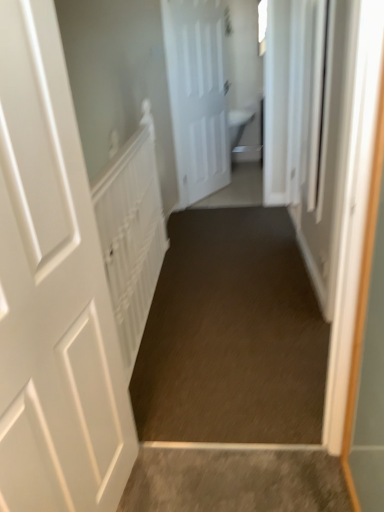
Question: Which direction should I rotate to look at white matte door at center, which is the first door from right to left, — up or down?

Choices:
 (A) up
 (B) down

Answer: (A)

Question: Is white matte door at left, the 2th door viewed from the right, at the right side of brown carpet at center?

Choices:
 (A) yes
 (B) no

Answer: (B)

Question: Is white matte door at left, placed as the first door when sorted from left to right, not close to brown carpet at center?

Choices:
 (A) yes
 (B) no

Answer: (B)

Question: Is the surface of white matte door at left, positioned as the second door in back-to-front order, in direct contact with brown carpet at center?

Choices:
 (A) no
 (B) yes

Answer: (A)

Question: Can you confirm if white matte door at left, positioned as the second door in back-to-front order, is bigger than brown carpet at center?

Choices:
 (A) no
 (B) yes

Answer: (A)

Question: Could brown carpet at center be considered to be inside white matte door at left, placed as the first door when sorted from left to right?

Choices:
 (A) no
 (B) yes

Answer: (A)

Question: Is white matte door at left, positioned as the second door in back-to-front order, closer to the viewer compared to brown carpet at center?

Choices:
 (A) no
 (B) yes

Answer: (B)

Question: Is white matte door at left, which appears as the first door when viewed from the front, completely or partially inside white textured radiator at left?

Choices:
 (A) yes
 (B) no

Answer: (B)

Question: Considering the relative sizes of white textured radiator at left and white matte door at left, acting as the 1th door starting from the bottom, in the image provided, is white textured radiator at left thinner than white matte door at left, acting as the 1th door starting from the bottom,?

Choices:
 (A) no
 (B) yes

Answer: (B)

Question: From a real-world perspective, is white textured radiator at left located beneath white matte door at left, acting as the 1th door starting from the bottom?

Choices:
 (A) no
 (B) yes

Answer: (B)

Question: Is white textured radiator at left closer to camera compared to white matte door at left, placed as the first door when sorted from left to right?

Choices:
 (A) yes
 (B) no

Answer: (B)

Question: Can you confirm if white textured radiator at left is bigger than white matte door at left, positioned as the second door in back-to-front order?

Choices:
 (A) no
 (B) yes

Answer: (B)

Question: Does white textured radiator at left have a lesser height compared to white matte door at left, acting as the 1th door starting from the bottom?

Choices:
 (A) no
 (B) yes

Answer: (B)

Question: Is white textured radiator at left aimed at white matte door at center, positioned as the 2th door in bottom-to-top order?

Choices:
 (A) no
 (B) yes

Answer: (A)